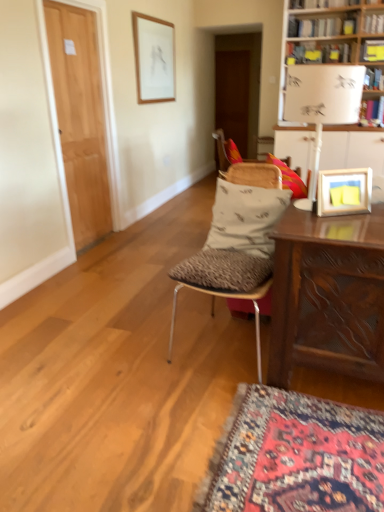
Locate an element on the screen. The width and height of the screenshot is (384, 512). space that is in front of metallic silver chair at center, positioned as the 1th chair in front-to-back order is located at coordinates (230, 414).